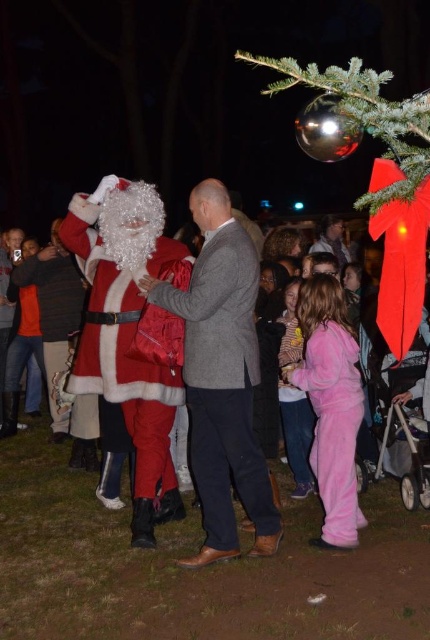
Question: Can you confirm if matte gray suit at center is positioned to the right of pink fleece pajamas at lower right?

Choices:
 (A) yes
 (B) no

Answer: (B)

Question: Is fuzzy red santa at left smaller than pink fleece pants at lower center?

Choices:
 (A) no
 (B) yes

Answer: (A)

Question: Is pink fleece pajamas at lower right to the right of pink fleece pants at lower center from the viewer's perspective?

Choices:
 (A) yes
 (B) no

Answer: (A)

Question: Among these objects, which one is nearest to the camera?

Choices:
 (A) dark gray wool coat at center
 (B) fuzzy red santa at left
 (C) pink fleece pants at lower center
 (D) pink fleece pajamas at lower right

Answer: (D)

Question: Which point appears farthest from the camera in this image?

Choices:
 (A) (352, 385)
 (B) (291, 324)
 (C) (171, 376)
 (D) (190, 285)

Answer: (B)

Question: Which point appears closest to the camera in this image?

Choices:
 (A) (300, 476)
 (B) (68, 284)
 (C) (337, 307)

Answer: (C)